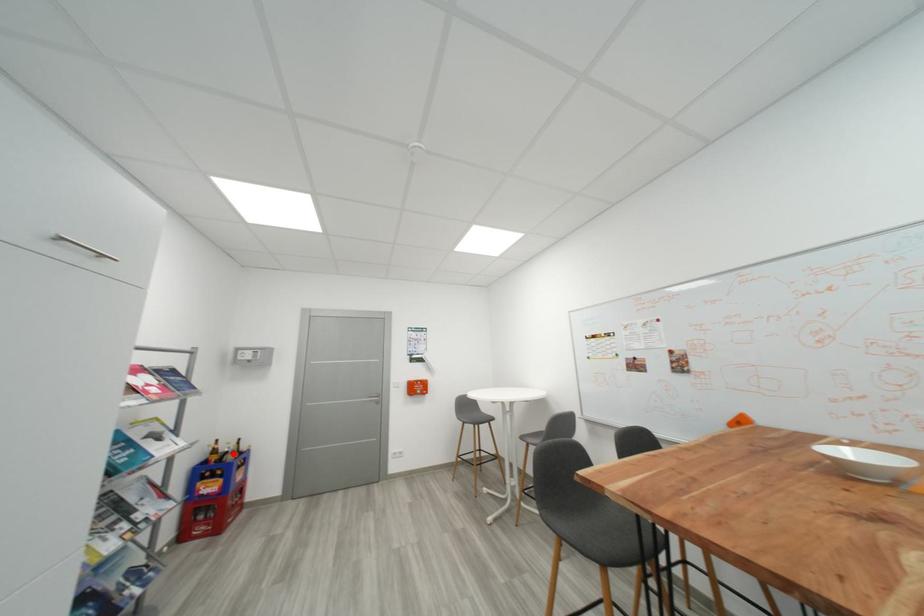
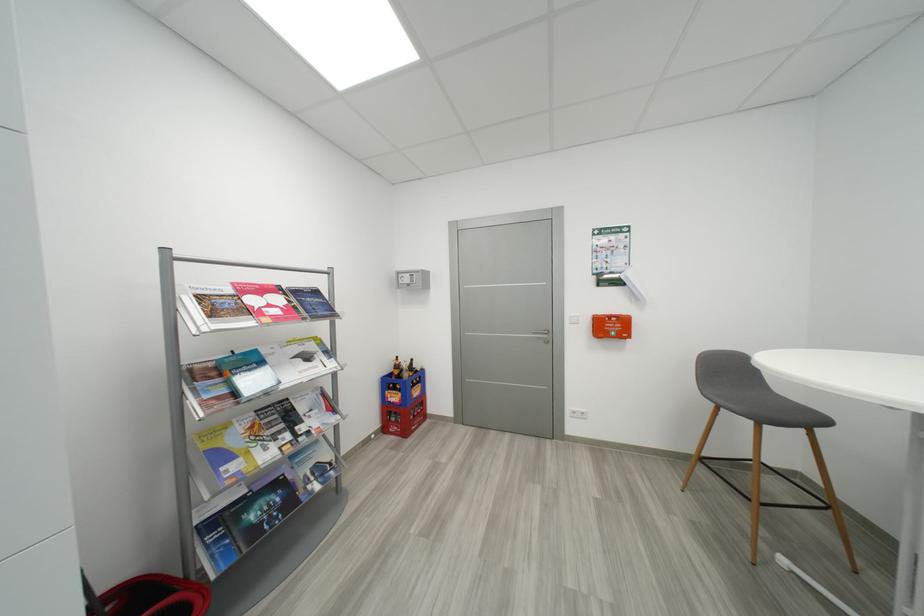
Find the pixel in the second image that matches the highlighted location in the first image.

(408, 371)